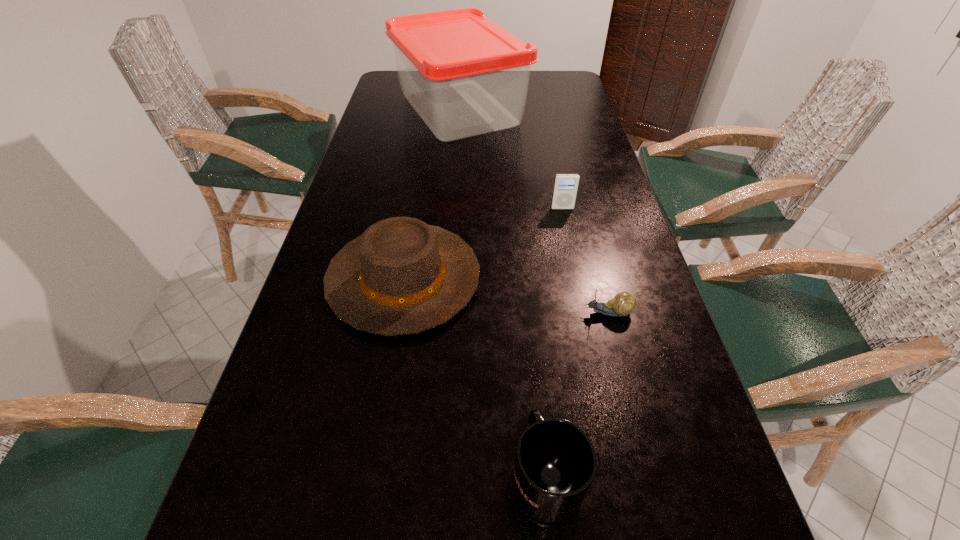
Identify the location of vacant region located 0.390m with the handle on the side of the mug. The height and width of the screenshot is (540, 960). (525, 267).

You are a GUI agent. You are given a task and a screenshot of the screen. Output one action in this format:
    pyautogui.click(x=<x>, y=<y>)
    Task: Click on the vacant space located 0.080m on the front-facing side of the second farthest object
    The width and height of the screenshot is (960, 540).
    Given the screenshot: What is the action you would take?
    pyautogui.click(x=567, y=230)

Locate an element on the screen. vacant space located 0.400m on the front-facing side of the shortest object is located at coordinates (389, 313).

Image resolution: width=960 pixels, height=540 pixels. I want to click on vacant space positioned on the front-facing side of the shortest object, so coord(389,313).

In order to click on free space located 0.190m on the front-facing side of the shortest object in this screenshot , I will do `click(491, 313)`.

This screenshot has height=540, width=960. Find the location of `object that is at the far edge`. object that is at the far edge is located at coordinates (464, 75).

The width and height of the screenshot is (960, 540). Identify the location of tray positioned at the left edge. (464, 75).

Image resolution: width=960 pixels, height=540 pixels. I want to click on cowboy hat that is at the left edge, so click(402, 276).

You are a GUI agent. You are given a task and a screenshot of the screen. Output one action in this format:
    pyautogui.click(x=<x>, y=<y>)
    Task: Click on the iPod located in the right edge section of the desktop
    
    Given the screenshot: What is the action you would take?
    pyautogui.click(x=566, y=185)

At what (x,y) coordinates should I click in order to perform the action: click on escargot situated at the right edge. Please return your answer as a coordinate pair (x, y). This screenshot has width=960, height=540. Looking at the image, I should click on (623, 303).